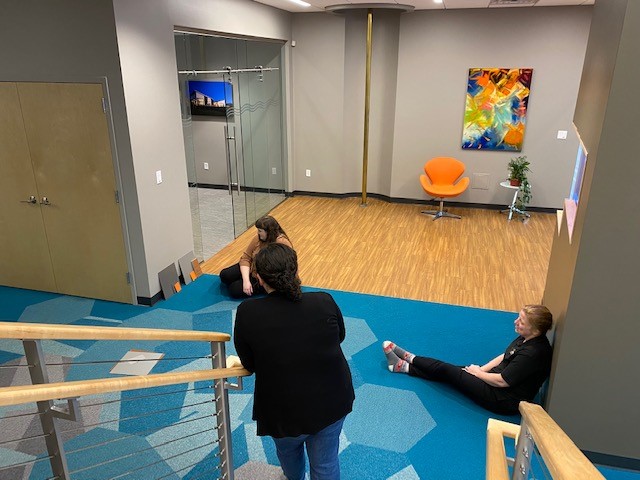
The image size is (640, 480). What are the coordinates of `green plant` in the screenshot? It's located at (518, 170).